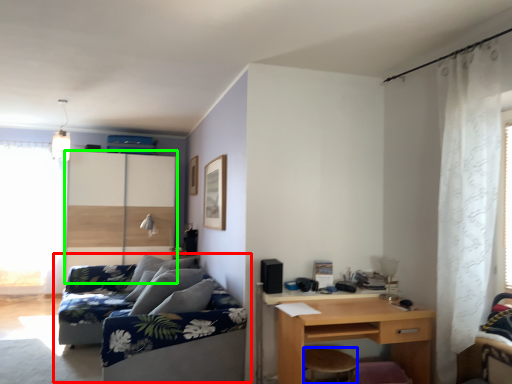
Question: Which object is positioned closest to studio couch (highlighted by a red box)? Select from stool (highlighted by a blue box) and screen door (highlighted by a green box).

Choices:
 (A) stool
 (B) screen door

Answer: (A)